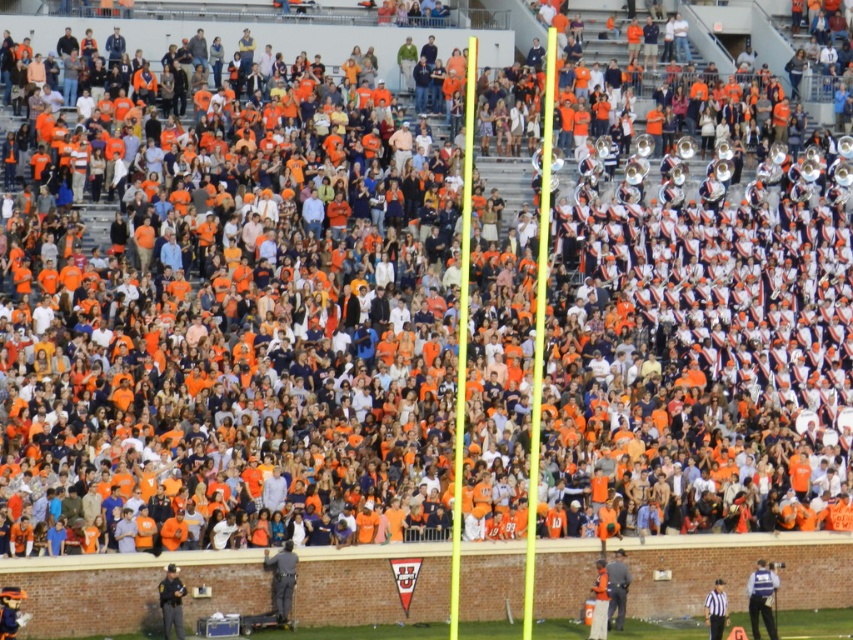
You are a photographer standing at the edge of the field. You want to take a picture of the gray fabric jacket at lower right and the striped fabric referee at lower right. Which one is wider in the image?

The gray fabric jacket at lower right might be wider than striped fabric referee at lower right.

You are a spectator at the football stadium and want to take a photo of the blue uniform at center and the striped fabric referee at lower right. Which object should you focus on first if you want to capture both in the same frame without moving the camera?

The blue uniform at center is positioned under striped fabric referee at lower right, so you should focus on the striped fabric referee at lower right first as it is closer to the camera, allowing both objects to be in the frame without moving the camera.

You are standing at the point with coordinates point (x=717, y=621) and want to walk towards the point with coordinates point (x=751, y=628). Which direction should you move in to reach it?

You should move forward because point (x=751, y=628) is behind point (x=717, y=621).